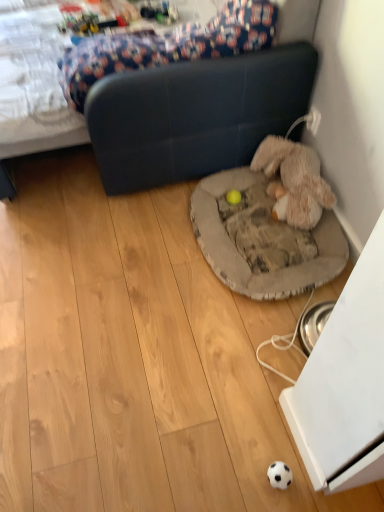
Question: Considering the relative sizes of dark blue leather studio couch at center and yellow rubber ball at center, which ranks as the 1th toy in left-to-right order, in the image provided, is dark blue leather studio couch at center wider than yellow rubber ball at center, which ranks as the 1th toy in left-to-right order,?

Choices:
 (A) yes
 (B) no

Answer: (A)

Question: Is dark blue leather studio couch at center looking in the opposite direction of yellow rubber ball at center, which ranks as the 1th toy in left-to-right order?

Choices:
 (A) yes
 (B) no

Answer: (B)

Question: Is dark blue leather studio couch at center smaller than yellow rubber ball at center, marked as the 2th toy in a right-to-left arrangement?

Choices:
 (A) yes
 (B) no

Answer: (B)

Question: Considering the relative sizes of dark blue leather studio couch at center and yellow rubber ball at center, marked as the 2th toy in a right-to-left arrangement, in the image provided, is dark blue leather studio couch at center thinner than yellow rubber ball at center, marked as the 2th toy in a right-to-left arrangement,?

Choices:
 (A) no
 (B) yes

Answer: (A)

Question: Does dark blue leather studio couch at center come in front of yellow rubber ball at center, marked as the 2th toy in a right-to-left arrangement?

Choices:
 (A) no
 (B) yes

Answer: (B)

Question: In terms of height, does fuzzy beige stuffed animal at lower right, the 2th toy from the left, look taller or shorter compared to dark blue leather studio couch at center?

Choices:
 (A) tall
 (B) short

Answer: (B)

Question: In the image, is fuzzy beige stuffed animal at lower right, which ranks as the 1th toy in right-to-left order, on the left side or the right side of dark blue leather studio couch at center?

Choices:
 (A) left
 (B) right

Answer: (B)

Question: Looking at the image, does fuzzy beige stuffed animal at lower right, which ranks as the 1th toy in right-to-left order, seem bigger or smaller compared to dark blue leather studio couch at center?

Choices:
 (A) small
 (B) big

Answer: (A)

Question: From the image's perspective, is fuzzy beige stuffed animal at lower right, which ranks as the 1th toy in right-to-left order, positioned above or below dark blue leather studio couch at center?

Choices:
 (A) above
 (B) below

Answer: (B)

Question: Is point (215, 242) closer or farther from the camera than point (304, 10)?

Choices:
 (A) closer
 (B) farther

Answer: (B)

Question: In terms of width, does gray fabric dog bed at center look wider or thinner when compared to dark blue leather studio couch at center?

Choices:
 (A) wide
 (B) thin

Answer: (B)

Question: Is gray fabric dog bed at center inside the boundaries of dark blue leather studio couch at center, or outside?

Choices:
 (A) inside
 (B) outside

Answer: (B)

Question: In the image, is gray fabric dog bed at center positioned in front of or behind dark blue leather studio couch at center?

Choices:
 (A) front
 (B) behind

Answer: (B)

Question: Is dark blue leather studio couch at center in front of or behind yellow rubber ball at center, which ranks as the 1th toy in left-to-right order, in the image?

Choices:
 (A) front
 (B) behind

Answer: (A)

Question: Based on their sizes in the image, would you say dark blue leather studio couch at center is bigger or smaller than yellow rubber ball at center, which ranks as the 1th toy in left-to-right order?

Choices:
 (A) big
 (B) small

Answer: (A)